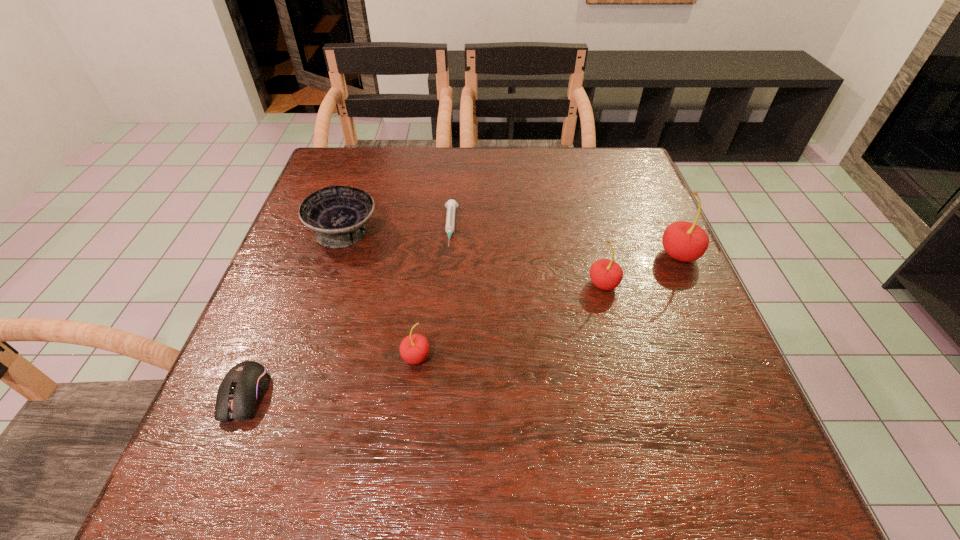
To make them evenly spaced by inserting another cherry among them, please locate a free space for this new cherry. Please provide its 2D coordinates. Your answer should be formatted as a tuple, i.e. [(x, y)], where the tuple contains the x and y coordinates of a point satisfying the conditions above.

[(516, 318)]